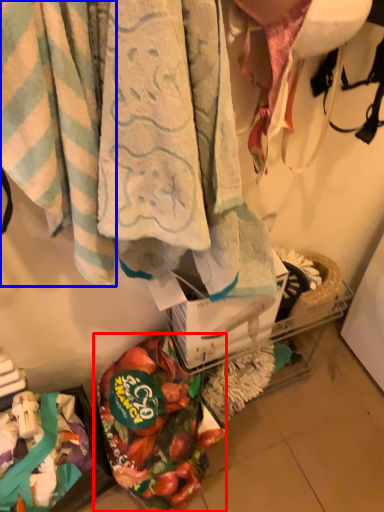
Question: Which object appears farthest to the camera in this image, food (highlighted by a red box) or towel (highlighted by a blue box)?

Choices:
 (A) food
 (B) towel

Answer: (A)